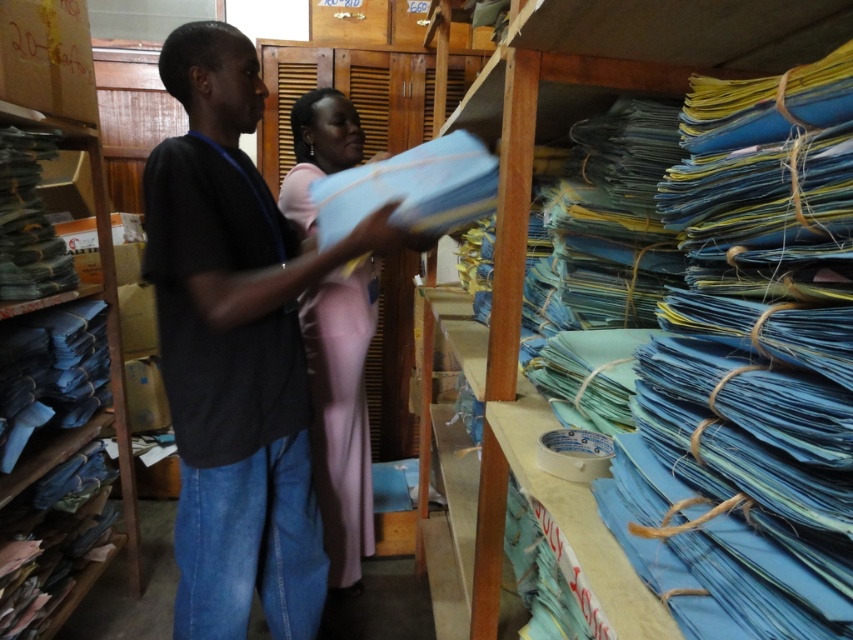
Does blue paper at right have a lesser width compared to pink fabric at center?

Indeed, blue paper at right has a lesser width compared to pink fabric at center.

Which of these two, blue paper at right or pink fabric at center, stands taller?

With more height is pink fabric at center.

Find the location of a particular element. blue paper at right is located at coordinates (761, 333).

Is black matte shirt at center further to camera compared to pink fabric at center?

No, black matte shirt at center is in front of pink fabric at center.

Is black matte shirt at center wider than pink fabric at center?

Correct, the width of black matte shirt at center exceeds that of pink fabric at center.

Where is `black matte shirt at center`? The height and width of the screenshot is (640, 853). black matte shirt at center is located at coordinates (235, 349).

This screenshot has height=640, width=853. In order to click on black matte shirt at center in this screenshot , I will do `click(235, 349)`.

Is blue paper at right bigger than black matte shirt at center?

No.

Between point (804, 516) and point (311, 618), which one is positioned behind?

Positioned behind is point (311, 618).

Find the location of `blue paper at right`. blue paper at right is located at coordinates (761, 333).